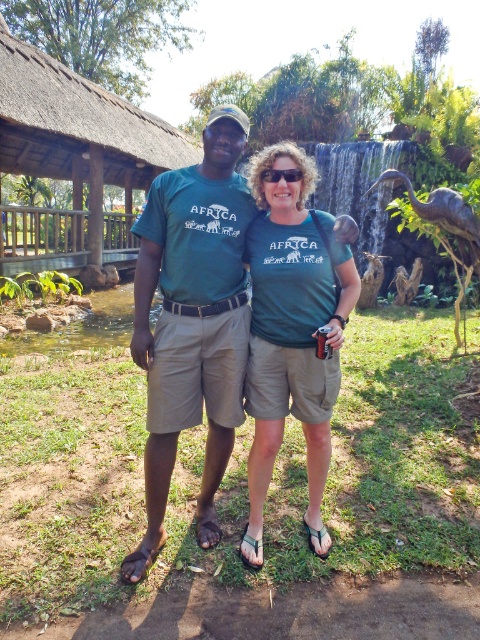
Identify the location of green cotton t-shirt at center. (192, 321).

Between point (172, 291) and point (315, 401), which one is positioned in front?

Point (172, 291) is more forward.

Which is behind, point (195, 348) or point (277, 378)?

Positioned behind is point (277, 378).

Where is `green cotton t-shirt at center`? This screenshot has height=640, width=480. green cotton t-shirt at center is located at coordinates (192, 321).